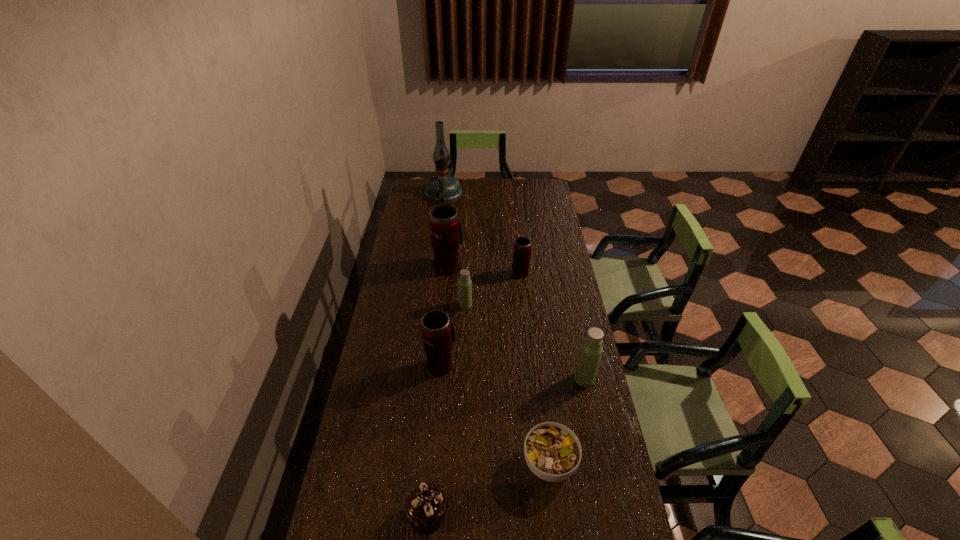
What are the coordinates of `the farther light thermos bottle` in the screenshot? It's located at tap(465, 284).

Find the location of a particular element. The width and height of the screenshot is (960, 540). brown cupcake is located at coordinates (425, 508).

Where is `the seventh tallest object`? This screenshot has height=540, width=960. the seventh tallest object is located at coordinates (425, 508).

Find the location of a particular element. The width and height of the screenshot is (960, 540). soup bowl is located at coordinates (552, 451).

Locate an element on the screen. This screenshot has width=960, height=540. the second nearest object is located at coordinates (552, 451).

Identify the location of blank space located 0.200m on the front of the farthest object. Image resolution: width=960 pixels, height=540 pixels. (440, 226).

The width and height of the screenshot is (960, 540). I want to click on free space located 0.380m on the side with the handle of the second tallest object, so click(453, 213).

Find the location of `vacant space located 0.210m on the side with the handle of the second tallest object`. vacant space located 0.210m on the side with the handle of the second tallest object is located at coordinates (451, 231).

Locate an element on the screen. The image size is (960, 540). vacant position located 0.050m on the side with the handle of the second tallest object is located at coordinates (449, 250).

Locate an element on the screen. The image size is (960, 540). vacant space positioned on the side with the handle of the second biggest red thermos bottle is located at coordinates (445, 307).